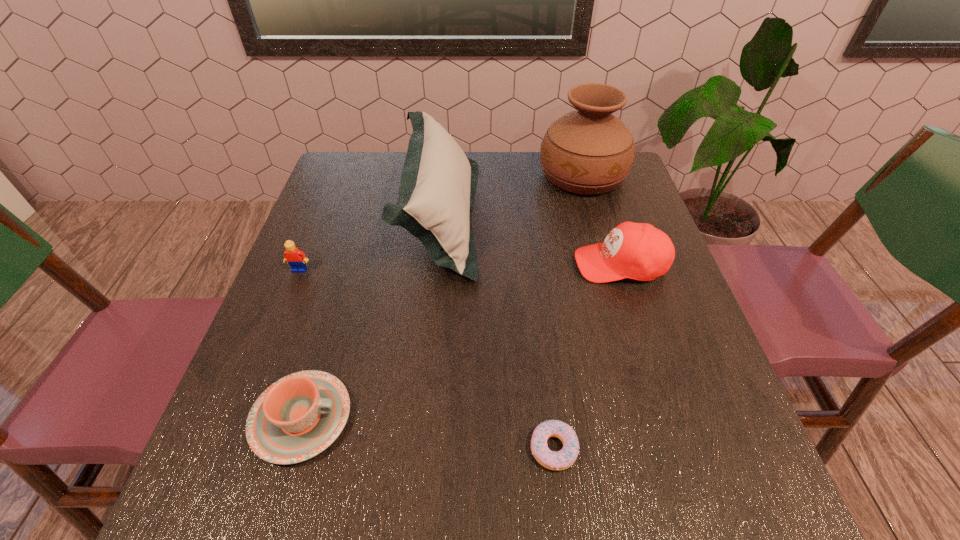
I want to click on vacant area situated on the front panel of the baseball cap, so 411,264.

This screenshot has height=540, width=960. I want to click on free location located on the front panel of the baseball cap, so click(505, 264).

The image size is (960, 540). In order to click on vacant space located 0.160m on the front panel of the baseball cap in this screenshot , I will do `click(505, 264)`.

Where is `vacant region located on the face of the third shortest object`? The width and height of the screenshot is (960, 540). vacant region located on the face of the third shortest object is located at coordinates (231, 440).

What are the coordinates of `vacant space located on the handle side of the chinaware` in the screenshot? It's located at (530, 418).

The image size is (960, 540). Find the location of `free space located 0.210m on the left of the shortest object`. free space located 0.210m on the left of the shortest object is located at coordinates (402, 449).

Where is `urn situated at the far edge`? urn situated at the far edge is located at coordinates (588, 151).

This screenshot has width=960, height=540. I want to click on cushion located in the far edge section of the desktop, so point(438,183).

Locate an element on the screen. This screenshot has width=960, height=540. chinaware that is at the near edge is located at coordinates (296, 418).

The width and height of the screenshot is (960, 540). What are the coordinates of `doughnut located in the near edge section of the desktop` in the screenshot? It's located at (563, 459).